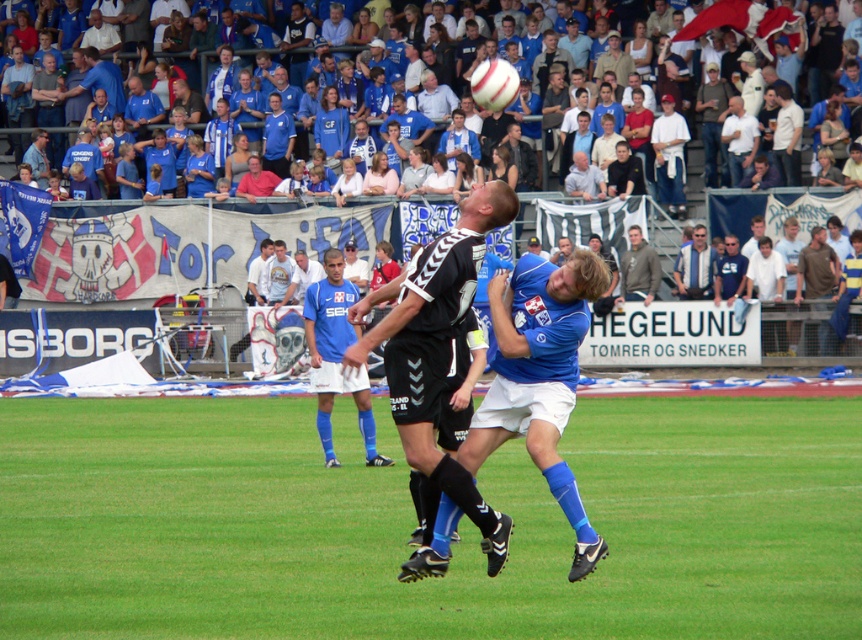
Based on the image, is the point at coordinates (411, 524) located on the green grass at center?

Yes, the point at coordinates (411, 524) is located on the green grass at center as described.